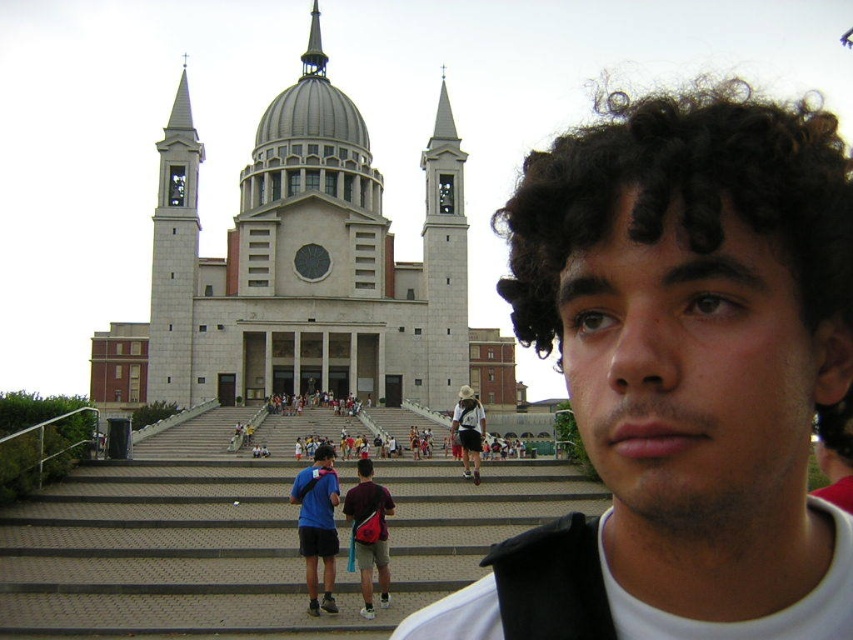
Question: Considering the real-world distances, which object is farthest from the shiny silver spire at upper center?

Choices:
 (A) concrete stairs at center
 (B) gray stone church at center
 (C) white stone bell tower at left
 (D) smooth stone tower at center

Answer: (A)

Question: Which point appears farthest from the camera in this image?

Choices:
 (A) (183, 150)
 (B) (318, 36)

Answer: (B)

Question: Does white stone bell tower at left come in front of blue fabric shirt at center?

Choices:
 (A) yes
 (B) no

Answer: (B)

Question: From the image, what is the correct spatial relationship of dark brown curly hair at center in relation to shiny silver spire at upper center?

Choices:
 (A) left
 (B) right

Answer: (B)

Question: Does concrete stairs at center come behind shiny silver spire at upper center?

Choices:
 (A) no
 (B) yes

Answer: (A)

Question: Which object is farther from the camera taking this photo?

Choices:
 (A) dark brown curly hair at center
 (B) blue fabric shirt at center
 (C) concrete stairs at center
 (D) gray stone church at center

Answer: (D)